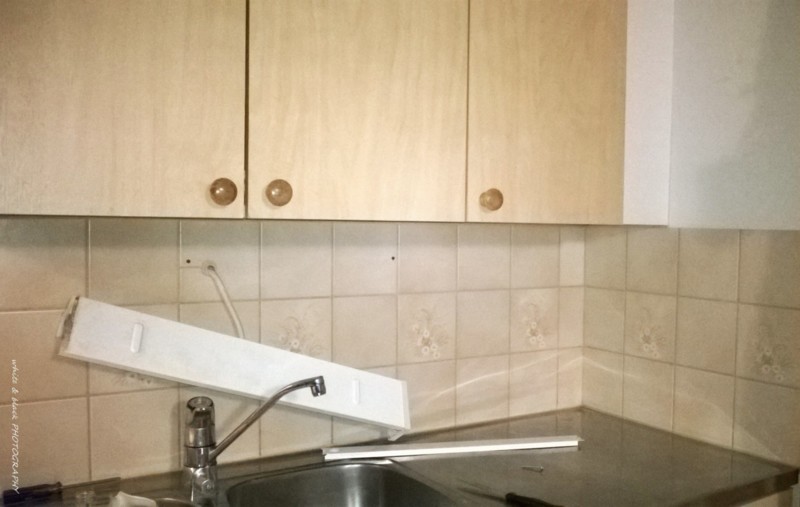
At what (x,y) coordinates should I click in order to perform the action: click on knobs. Please return your answer as a coordinate pair (x, y). This screenshot has height=507, width=800. Looking at the image, I should click on (222, 190), (282, 197), (493, 198).